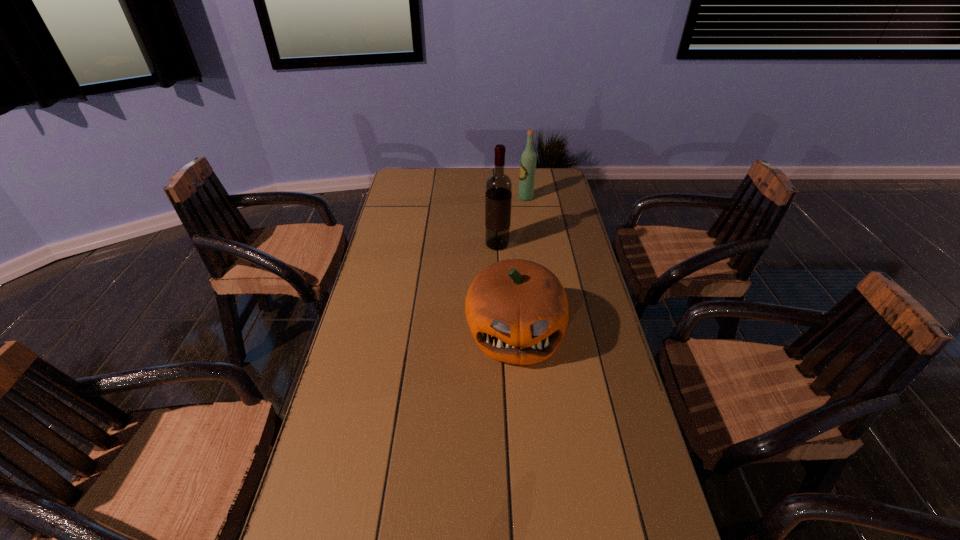
The height and width of the screenshot is (540, 960). I want to click on free space located 0.350m on the face of the shortest object, so click(528, 513).

The image size is (960, 540). Find the location of `object positioned at the far edge`. object positioned at the far edge is located at coordinates (528, 160).

Locate an element on the screen. Image resolution: width=960 pixels, height=540 pixels. wine bottle situated at the right edge is located at coordinates (528, 160).

Where is `pumpkin that is positioned at the right edge`? pumpkin that is positioned at the right edge is located at coordinates (517, 311).

Locate an element on the screen. The image size is (960, 540). object located in the far right corner section of the desktop is located at coordinates (528, 160).

Where is `free space at the far edge of the desktop`? The width and height of the screenshot is (960, 540). free space at the far edge of the desktop is located at coordinates (481, 184).

In order to click on vacant region at the left edge of the desktop in this screenshot , I will do `click(389, 327)`.

In the image, there is a desktop. In order to click on vacant region at the right edge in this screenshot , I will do `click(672, 535)`.

In the image, there is a desktop. At what (x,y) coordinates should I click in order to perform the action: click on free space at the far left corner. Please return your answer as a coordinate pair (x, y). Image resolution: width=960 pixels, height=540 pixels. Looking at the image, I should click on (430, 169).

In the image, there is a desktop. Where is `free region at the far right corner`? This screenshot has width=960, height=540. free region at the far right corner is located at coordinates (550, 171).